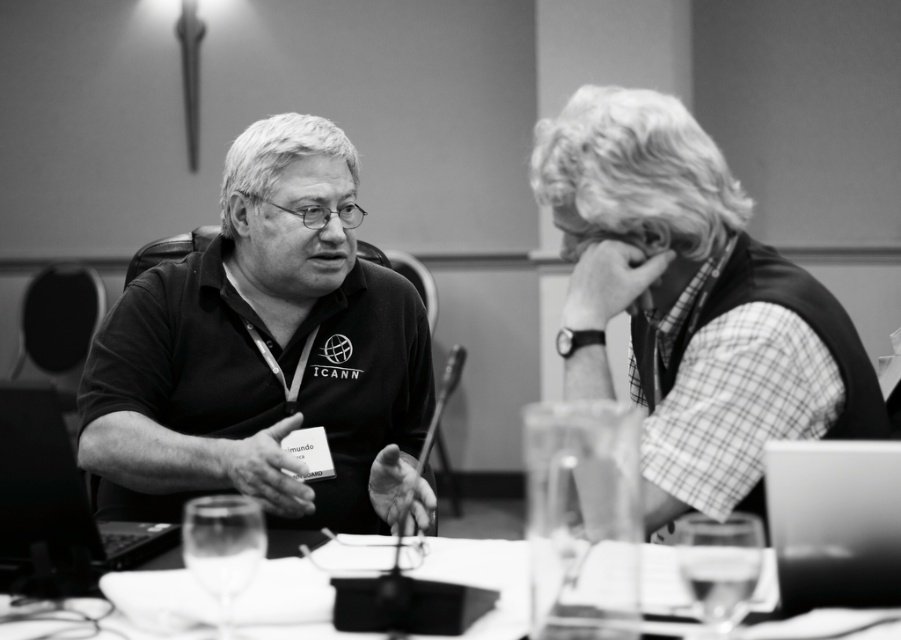
Does point (775, 435) come in front of point (123, 525)?

Yes, point (775, 435) is closer to viewer.

Is checkered fabric shirt at right positioned in front of metallic laptop at left?

No, checkered fabric shirt at right is behind metallic laptop at left.

Does point (663, 209) come closer to viewer compared to point (47, 392)?

No.

The width and height of the screenshot is (901, 640). Find the location of `checkered fabric shirt at right`. checkered fabric shirt at right is located at coordinates (690, 301).

Can you confirm if matte black polo shirt at center is positioned below metallic silver laptop at lower right?

No, matte black polo shirt at center is not below metallic silver laptop at lower right.

Where is `matte black polo shirt at center`? matte black polo shirt at center is located at coordinates [x=262, y=352].

Is the position of matte black polo shirt at center more distant than that of metallic laptop at left?

That is True.

Can you confirm if matte black polo shirt at center is wider than metallic laptop at left?

Indeed, matte black polo shirt at center has a greater width compared to metallic laptop at left.

The width and height of the screenshot is (901, 640). What do you see at coordinates (262, 352) in the screenshot?
I see `matte black polo shirt at center` at bounding box center [262, 352].

Identify the location of matte black polo shirt at center. Image resolution: width=901 pixels, height=640 pixels. pos(262,352).